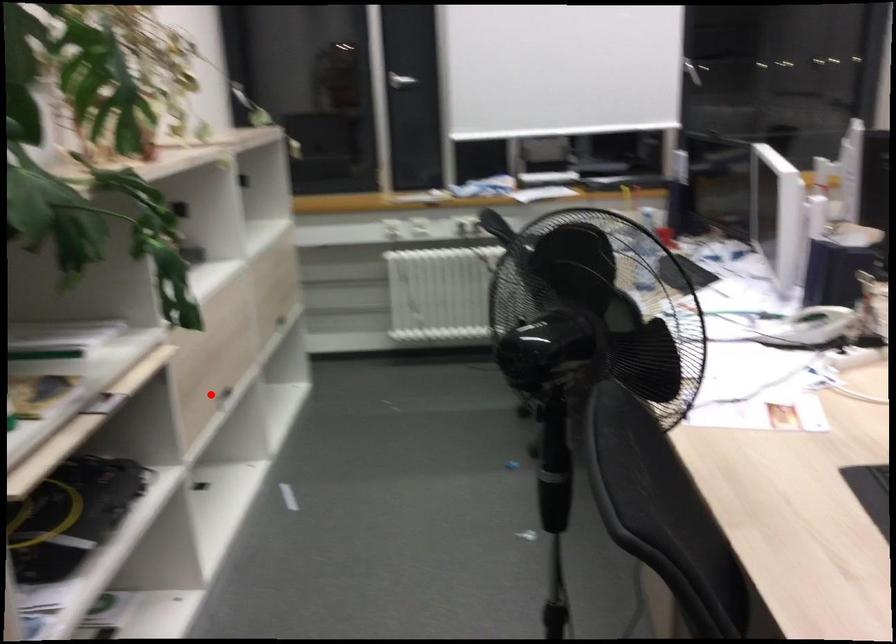
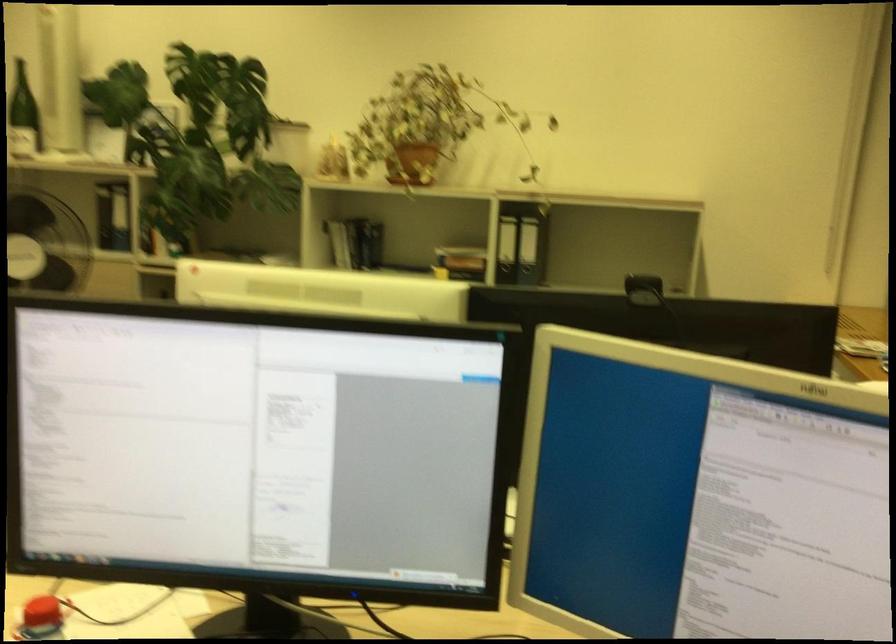
Question: I am providing you with two images of the same scene from different viewpoints. A red point is marked on the first image. Is the red point's position out of view in image 2?

Choices:
 (A) Yes
 (B) No

Answer: (A)